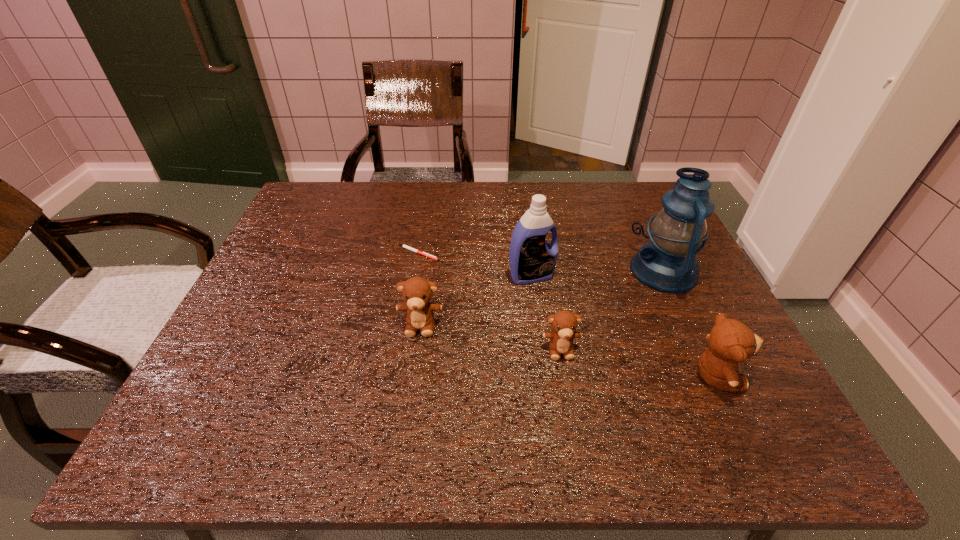
This screenshot has width=960, height=540. I want to click on free space for a new teddy bear on the left, so click(295, 302).